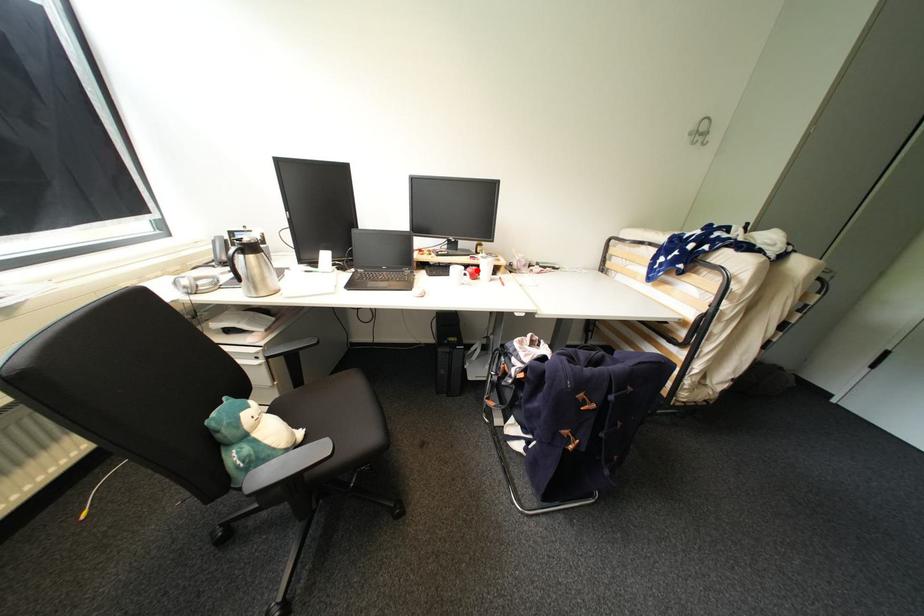
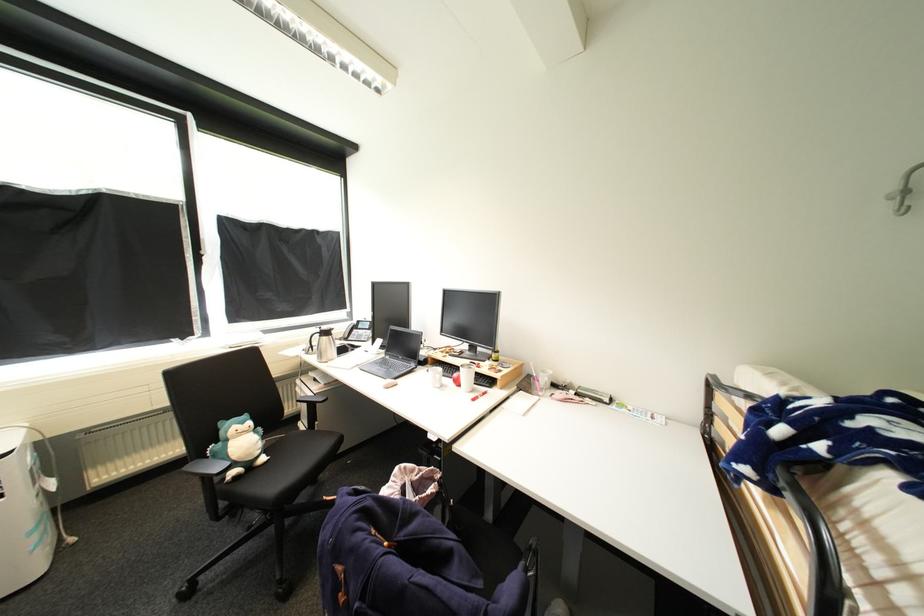
Find the pixel in the second image that matches the highlighted location in the first image.

(462, 376)